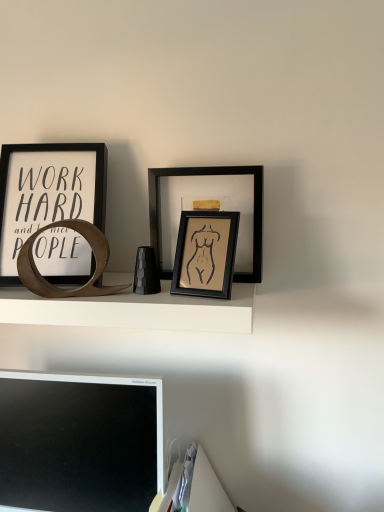
The height and width of the screenshot is (512, 384). Identify the location of free spot above white matte shelf at center (from a real-world perspective). (111, 290).